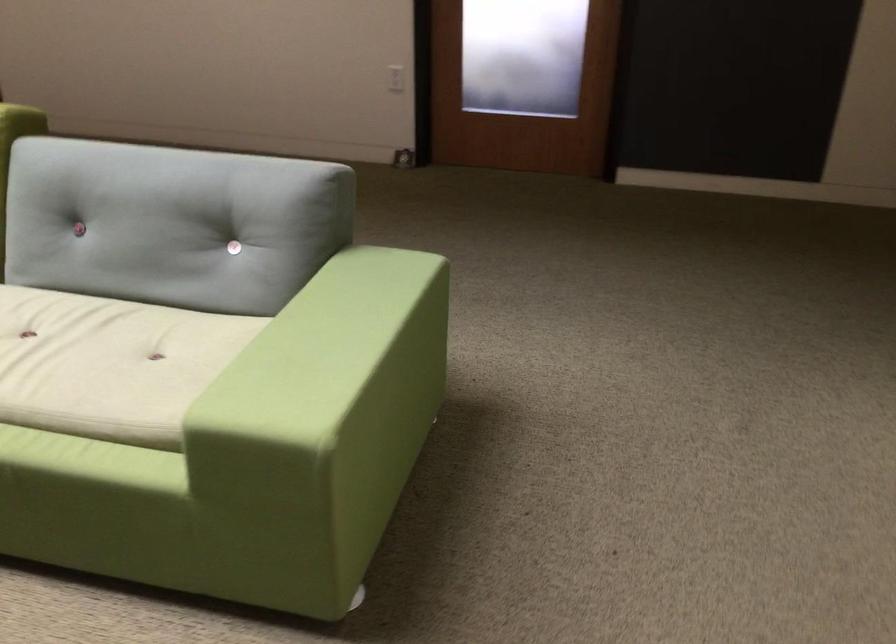
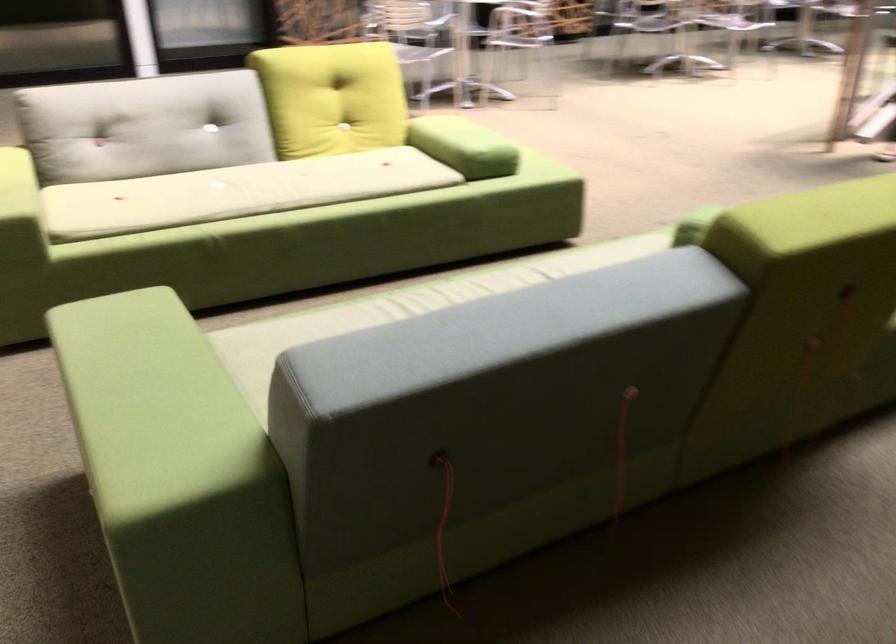
The point at (366, 290) is marked in the first image. Where is the corresponding point in the second image?

(151, 404)